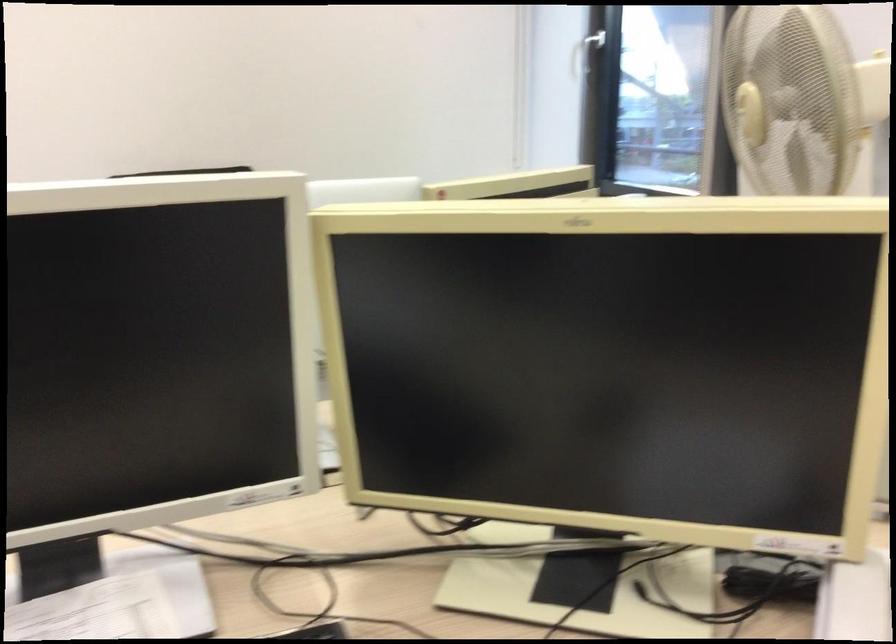
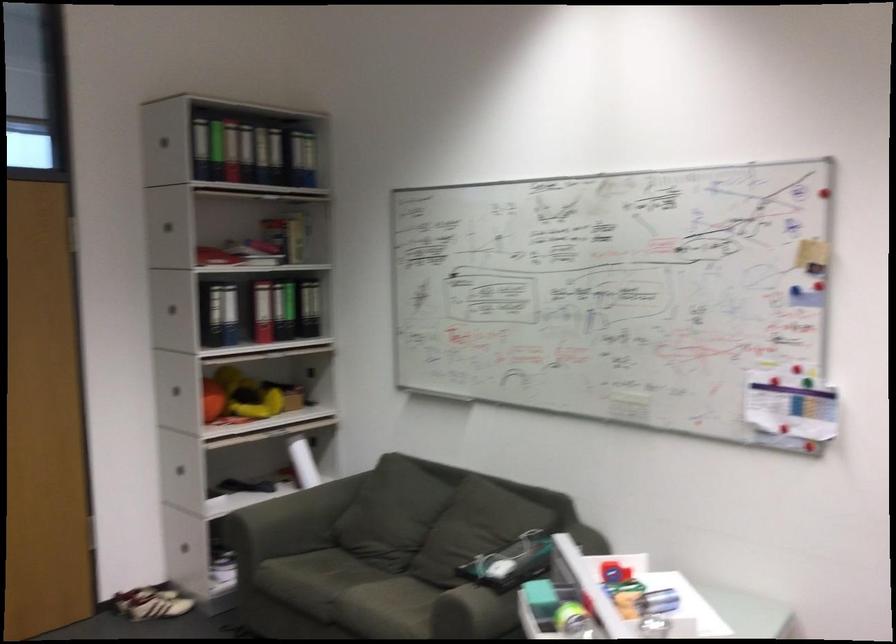
Question: The images are taken continuously from a first-person perspective. In which direction is your viewpoint rotating?

Choices:
 (A) Left
 (B) Right
 (C) Up
 (D) Down

Answer: (A)